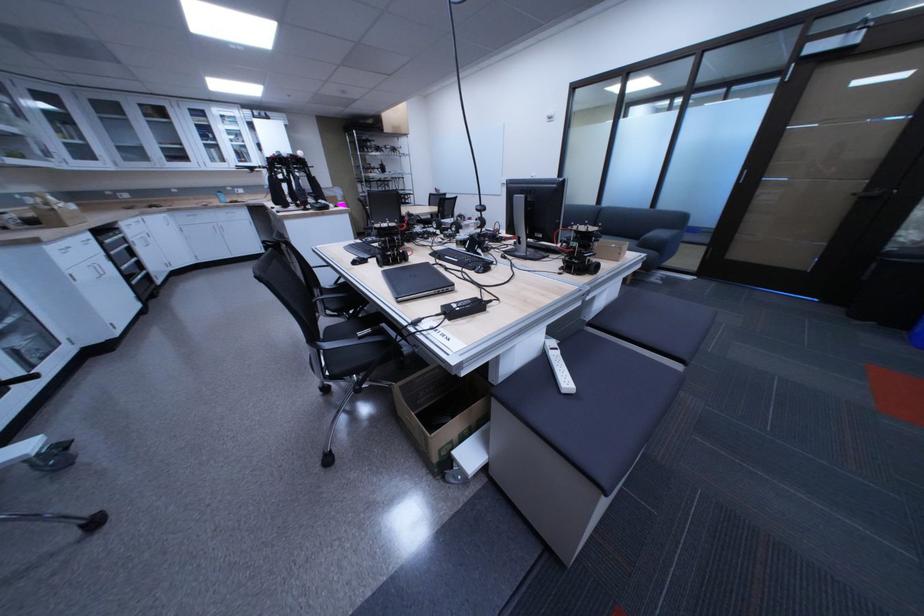
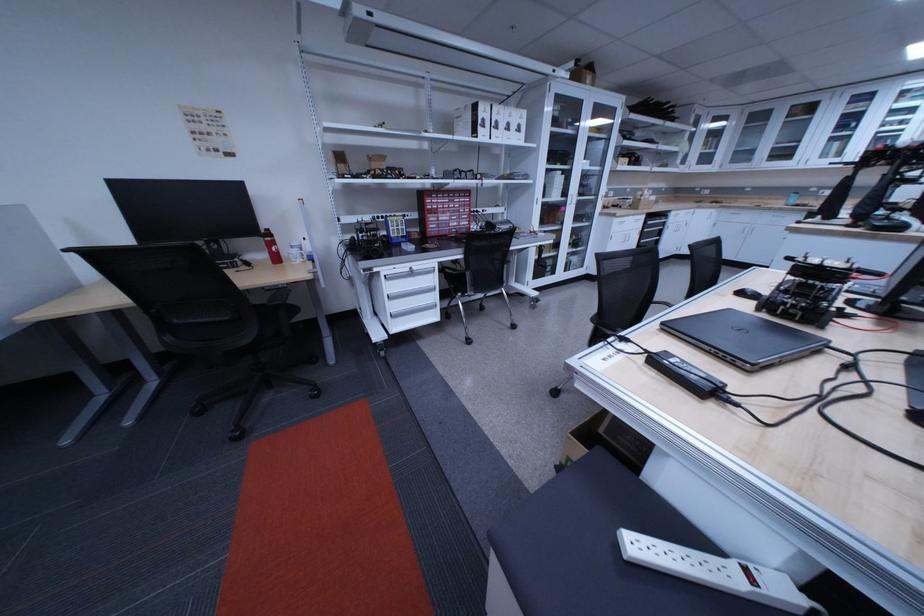
Find the pixel in the second image that matches (430,278) in the first image.

(755, 331)